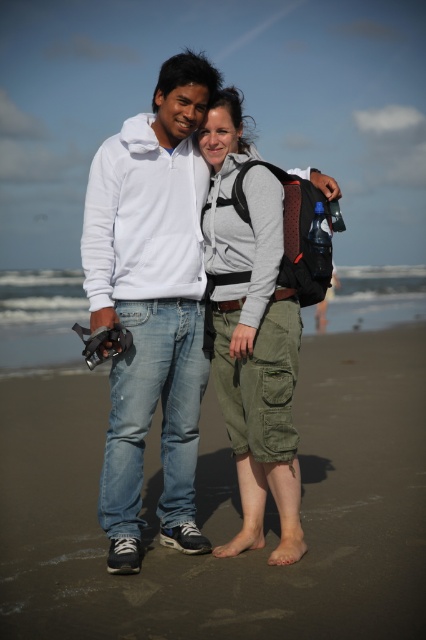
From the picture: Between brown sandy beach at lower center and olive green cargo shorts at center, which one has less height?

brown sandy beach at lower center

Is point (83, 531) positioned before point (261, 477)?

That is False.

This screenshot has height=640, width=426. Identify the location of brown sandy beach at lower center. (264, 515).

Is point (106, 147) closer to camera compared to point (282, 330)?

No.

Which is more to the right, white cotton hoodie at center or olive green cargo shorts at center?

olive green cargo shorts at center is more to the right.

Does point (129, 513) come closer to viewer compared to point (207, 244)?

That is True.

Find the location of `white cotton hoodie at center`. white cotton hoodie at center is located at coordinates (150, 305).

Identify the location of brown sandy beach at lower center. (264, 515).

Identify the location of brown sandy beach at lower center. (264, 515).